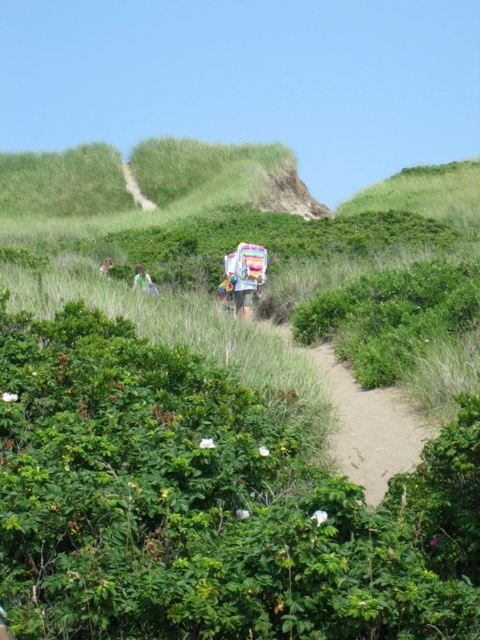
Is brown sandy path at center to the right of green fabric bag at left from the viewer's perspective?

Correct, you'll find brown sandy path at center to the right of green fabric bag at left.

Which is more to the right, brown sandy path at center or green fabric bag at left?

brown sandy path at center

Locate an element on the screen. This screenshot has height=640, width=480. brown sandy path at center is located at coordinates pyautogui.click(x=370, y=426).

Where is `brown sandy path at center`? The width and height of the screenshot is (480, 640). brown sandy path at center is located at coordinates (370, 426).

Locate an element on the screen. brown sandy path at center is located at coordinates (370, 426).

At what (x,y) coordinates should I click in order to perform the action: click on brown sandy path at center. Please return your answer as a coordinate pair (x, y). The image size is (480, 640). Looking at the image, I should click on (370, 426).

Can you confirm if light brown fabric at center is bigger than green fabric bag at left?

Yes, light brown fabric at center is bigger than green fabric bag at left.

Does light brown fabric at center have a lesser height compared to green fabric bag at left?

Incorrect, light brown fabric at center's height does not fall short of green fabric bag at left's.

At what (x,y) coordinates should I click in order to perform the action: click on light brown fabric at center. Please return your answer as a coordinate pair (x, y). Looking at the image, I should click on (143, 280).